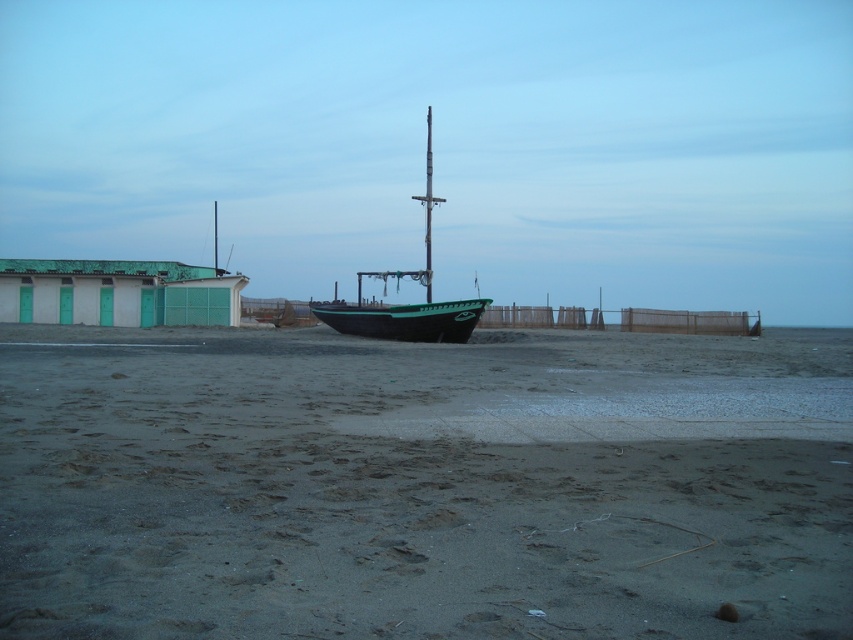
Find the location of a particular element. The image size is (853, 640). gray sand at center is located at coordinates (422, 483).

In the scene shown: Which of these two, gray sand at center or green matte boat at center, stands taller?

With more height is green matte boat at center.

Locate an element on the screen. The height and width of the screenshot is (640, 853). gray sand at center is located at coordinates tap(422, 483).

Image resolution: width=853 pixels, height=640 pixels. In order to click on gray sand at center in this screenshot , I will do `click(422, 483)`.